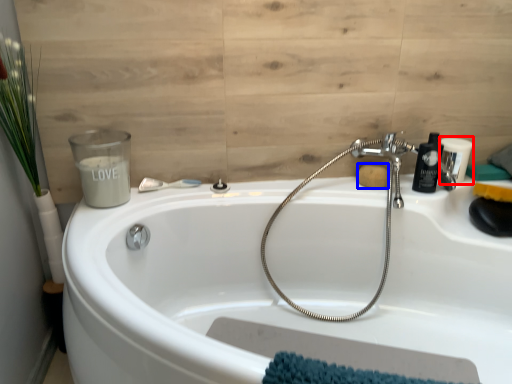
Question: Among these objects, which one is farthest to the camera, toiletry (highlighted by a red box) or soap (highlighted by a blue box)?

Choices:
 (A) toiletry
 (B) soap

Answer: (A)